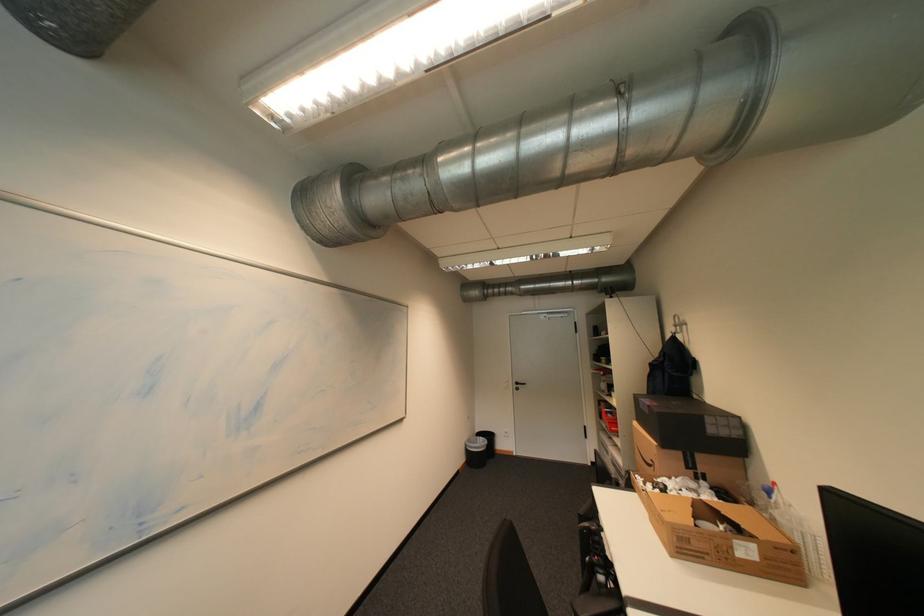
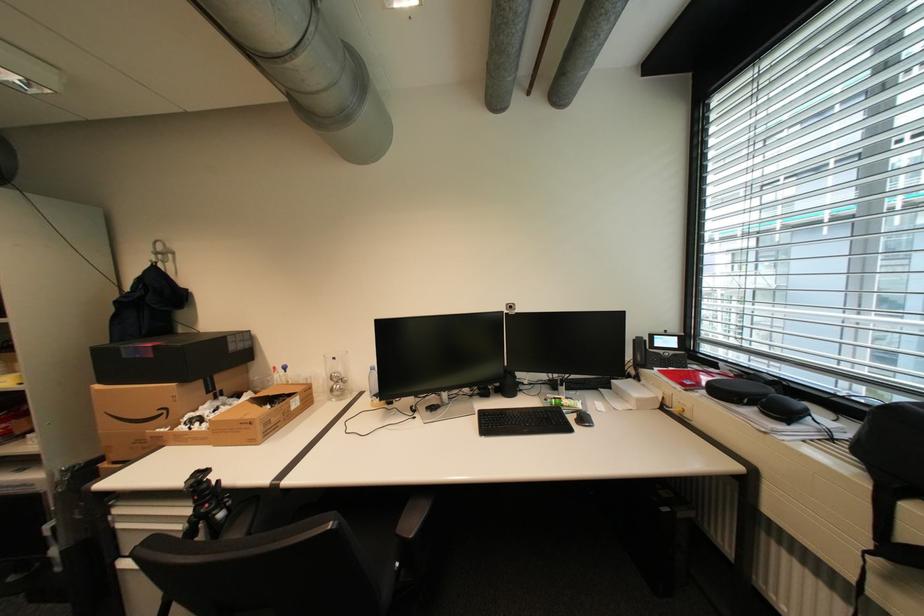
Question: The camera is either moving clockwise (left) or counter-clockwise (right) around the object. The first image is from the beginning of the video and the second image is from the end. Is the camera moving left or right when shooting the video?

Choices:
 (A) Left
 (B) Right

Answer: (A)